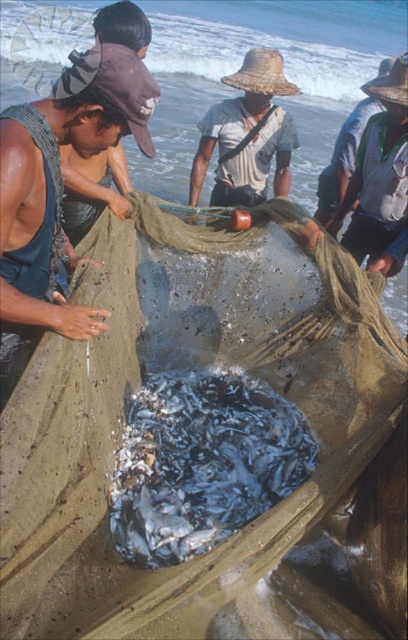
Question: Which object is closer to the camera taking this photo?

Choices:
 (A) shiny silver fish at center
 (B) matte brown hat at left
 (C) brown fabric hat at upper left

Answer: (B)

Question: Is shiny silver fish at center below brown fabric hat at upper left?

Choices:
 (A) no
 (B) yes

Answer: (B)

Question: Can you confirm if shiny silver fish at center is positioned to the right of brown fabric hat at upper left?

Choices:
 (A) no
 (B) yes

Answer: (B)

Question: Is shiny silver fish at center thinner than natural straw hat at upper center?

Choices:
 (A) yes
 (B) no

Answer: (B)

Question: Which point is closer to the camera?

Choices:
 (A) (137, 435)
 (B) (28, 164)

Answer: (B)

Question: Estimate the real-world distances between objects in this image. Which object is closer to the natural straw hat at center?

Choices:
 (A) matte brown hat at left
 (B) brown fabric hat at upper left
 (C) natural straw hat at upper center

Answer: (C)